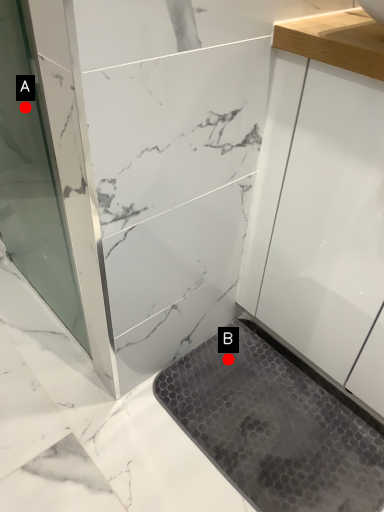
Question: Two points are circled on the image, labeled by A and B beside each circle. Which of the following is the closest to the observer?

Choices:
 (A) A is closer
 (B) B is closer

Answer: (B)